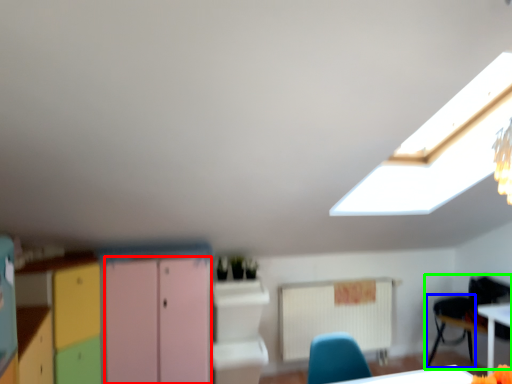
Question: Considering the real-world distances, which object is farthest from file cabinet (highlighted by a red box)? armchair (highlighted by a blue box) or chair (highlighted by a green box)?

Choices:
 (A) armchair
 (B) chair

Answer: (A)